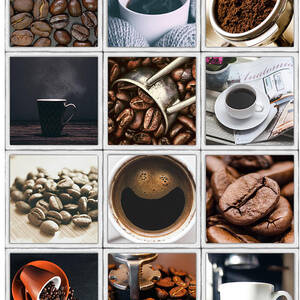
Where is `handles in the image`? handles in the image is located at coordinates (70, 108), (187, 103), (168, 70), (259, 107), (280, 294), (132, 275), (28, 294).